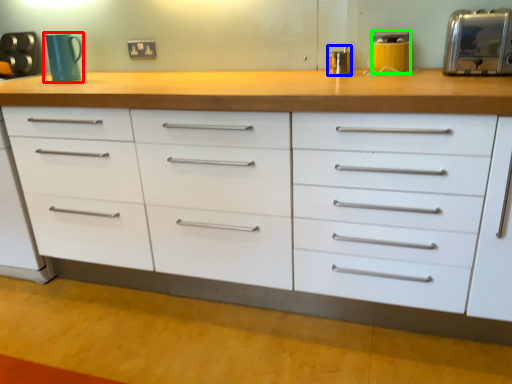
Question: Based on their relative distances, which object is nearer to mug (highlighted by a red box)? Choose from appliance (highlighted by a blue box) and appliance (highlighted by a green box).

Choices:
 (A) appliance
 (B) appliance

Answer: (A)